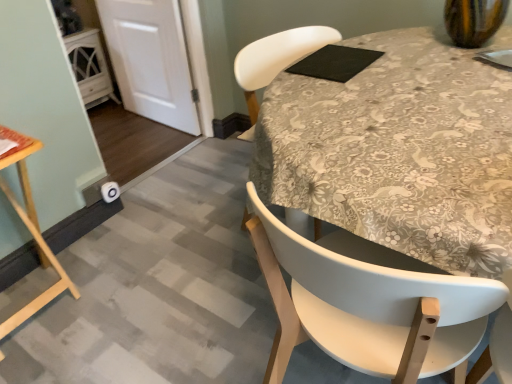
Question: Considering the relative positions of white matte chair at center and floral fabric tablecloth at center in the image provided, is white matte chair at center to the left of floral fabric tablecloth at center from the viewer's perspective?

Choices:
 (A) yes
 (B) no

Answer: (B)

Question: Is white matte chair at center at the right side of floral fabric tablecloth at center?

Choices:
 (A) no
 (B) yes

Answer: (B)

Question: Does white matte chair at center lie behind floral fabric tablecloth at center?

Choices:
 (A) no
 (B) yes

Answer: (A)

Question: Is white matte chair at center facing towards floral fabric tablecloth at center?

Choices:
 (A) no
 (B) yes

Answer: (A)

Question: Does white matte chair at center have a lesser height compared to floral fabric tablecloth at center?

Choices:
 (A) yes
 (B) no

Answer: (B)

Question: From their relative heights in the image, would you say wooden table at lower left is taller or shorter than white matte chair at center?

Choices:
 (A) tall
 (B) short

Answer: (B)

Question: From the image's perspective, is wooden table at lower left above or below white matte chair at center?

Choices:
 (A) below
 (B) above

Answer: (B)

Question: From a real-world perspective, is wooden table at lower left positioned above or below white matte chair at center?

Choices:
 (A) below
 (B) above

Answer: (A)

Question: In terms of size, does wooden table at lower left appear bigger or smaller than white matte chair at center?

Choices:
 (A) small
 (B) big

Answer: (A)

Question: From the image's perspective, is white matte chair at center located above or below black matte pad at upper center?

Choices:
 (A) above
 (B) below

Answer: (B)

Question: Considering the relative positions of white matte chair at center and black matte pad at upper center in the image provided, is white matte chair at center to the left or to the right of black matte pad at upper center?

Choices:
 (A) left
 (B) right

Answer: (B)

Question: Is white matte chair at center in front of or behind black matte pad at upper center in the image?

Choices:
 (A) behind
 (B) front

Answer: (B)

Question: Looking at their shapes, would you say white matte chair at center is wider or thinner than black matte pad at upper center?

Choices:
 (A) thin
 (B) wide

Answer: (B)

Question: Considering the positions of white matte chair at center and floral fabric tablecloth at center in the image, is white matte chair at center taller or shorter than floral fabric tablecloth at center?

Choices:
 (A) short
 (B) tall

Answer: (B)

Question: Is white matte chair at center inside the boundaries of floral fabric tablecloth at center, or outside?

Choices:
 (A) outside
 (B) inside

Answer: (A)